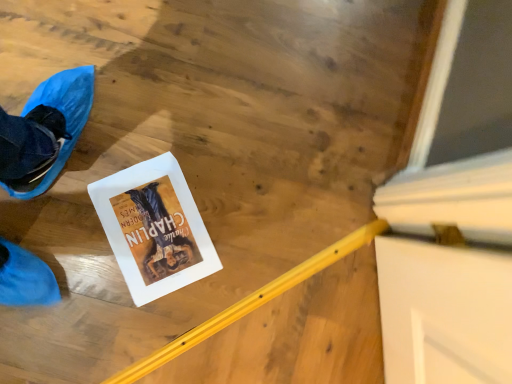
Identify the location of vacant point above white paper book cover at center (from a real-world perspective). (151, 225).